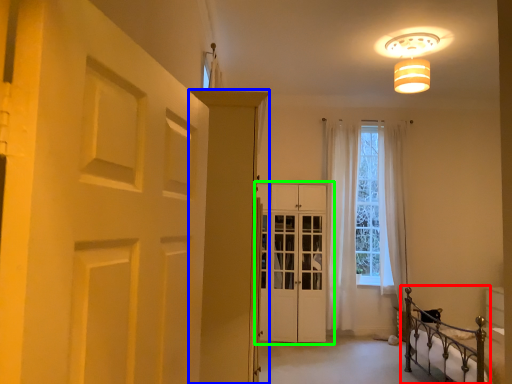
Question: Which is farther away from bed (highlighted by a red box)? door (highlighted by a blue box) or door (highlighted by a green box)?

Choices:
 (A) door
 (B) door

Answer: (A)